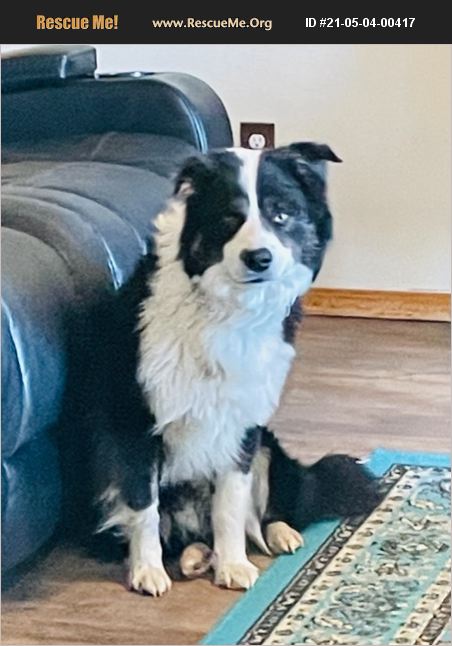
Find the location of a particular element. This screenshot has height=646, width=452. outlet is located at coordinates (260, 130).